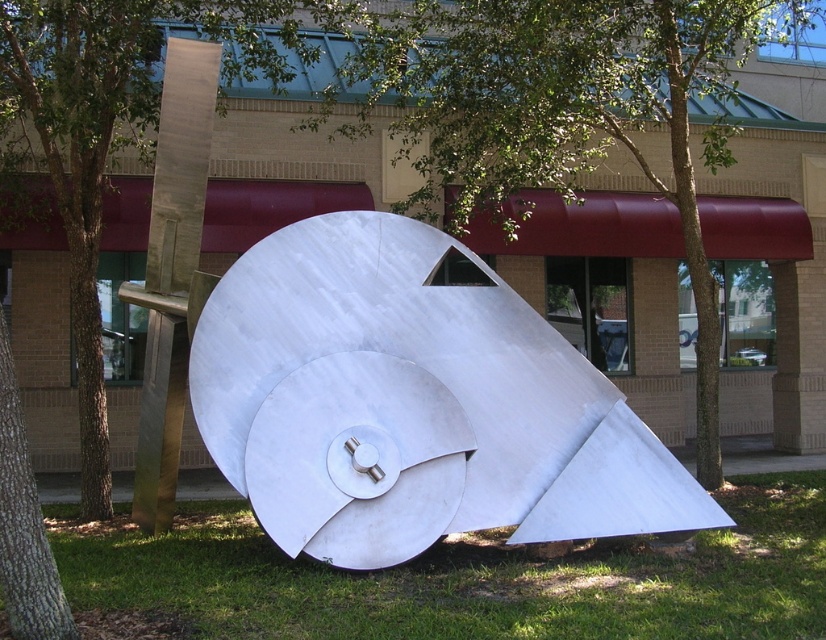
You are standing at the entrance of the building and want to take a photo of the metallic silver sculpture at center. Based on its position, which direction should you face to ensure the sculpture is centered in your camera frame?

The metallic silver sculpture at center is located at point coordinates, so you should face directly towards the sculpture to center it in your camera frame.

You are planning to place a new bench that is 2 meters wide in the area where the green grass at lower center is located. Given the space available, will the bench fit without overlapping the metallic silver sculpture at center?

The metallic silver sculpture at center has a width less than the green grass at lower center. Since the bench is 2 meters wide and the grass area is wider than the sculpture, the bench should fit as long as it is placed away from the sculpture.

You are standing in front of the building with the red awnings and want to take a photo of both the metallic silver sculpture at center and the green leafy tree at center. To ensure both are in the frame, should you position yourself to the left or right side of the sculpture?

You should position yourself to the right side of the metallic silver sculpture at center because it is to the left of the green leafy tree at center, so placing yourself to the right of the sculpture will allow both objects to be captured in the frame.